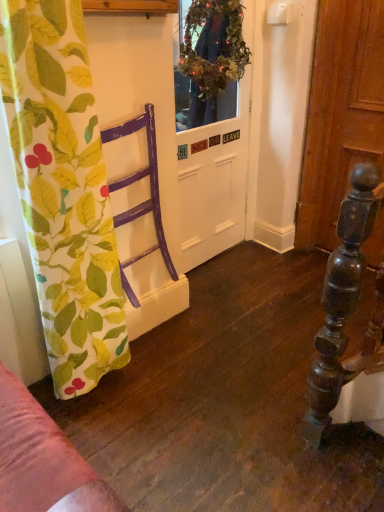
Question: Is white matte door at center at the back of purple wood chair at left?

Choices:
 (A) no
 (B) yes

Answer: (A)

Question: Considering the relative positions of purple wood chair at left and white matte door at center in the image provided, is purple wood chair at left in front of white matte door at center?

Choices:
 (A) yes
 (B) no

Answer: (A)

Question: Is purple wood chair at left not inside white matte door at center?

Choices:
 (A) no
 (B) yes

Answer: (B)

Question: From the image's perspective, would you say purple wood chair at left is shown under white matte door at center?

Choices:
 (A) no
 (B) yes

Answer: (B)

Question: From the image's perspective, is purple wood chair at left over white matte door at center?

Choices:
 (A) yes
 (B) no

Answer: (B)

Question: Does point (193, 118) appear closer or farther from the camera than point (233, 67)?

Choices:
 (A) farther
 (B) closer

Answer: (A)

Question: From a real-world perspective, relative to green leafy wreath at upper center, is white matte door at center vertically above or below?

Choices:
 (A) below
 (B) above

Answer: (A)

Question: Looking at the image, does white matte door at center seem bigger or smaller compared to green leafy wreath at upper center?

Choices:
 (A) big
 (B) small

Answer: (A)

Question: From the image's perspective, is white matte door at center positioned above or below green leafy wreath at upper center?

Choices:
 (A) below
 (B) above

Answer: (A)

Question: Is green leafy wreath at upper center taller or shorter than printed fabric curtain at left?

Choices:
 (A) short
 (B) tall

Answer: (A)

Question: Considering their positions, is green leafy wreath at upper center located in front of or behind printed fabric curtain at left?

Choices:
 (A) behind
 (B) front

Answer: (A)

Question: From a real-world perspective, is green leafy wreath at upper center above or below printed fabric curtain at left?

Choices:
 (A) below
 (B) above

Answer: (B)

Question: From the image's perspective, is green leafy wreath at upper center positioned above or below printed fabric curtain at left?

Choices:
 (A) above
 (B) below

Answer: (A)

Question: Is purple wood chair at left in front of or behind white matte door at center in the image?

Choices:
 (A) front
 (B) behind

Answer: (A)

Question: From the image's perspective, relative to white matte door at center, is purple wood chair at left above or below?

Choices:
 (A) above
 (B) below

Answer: (B)